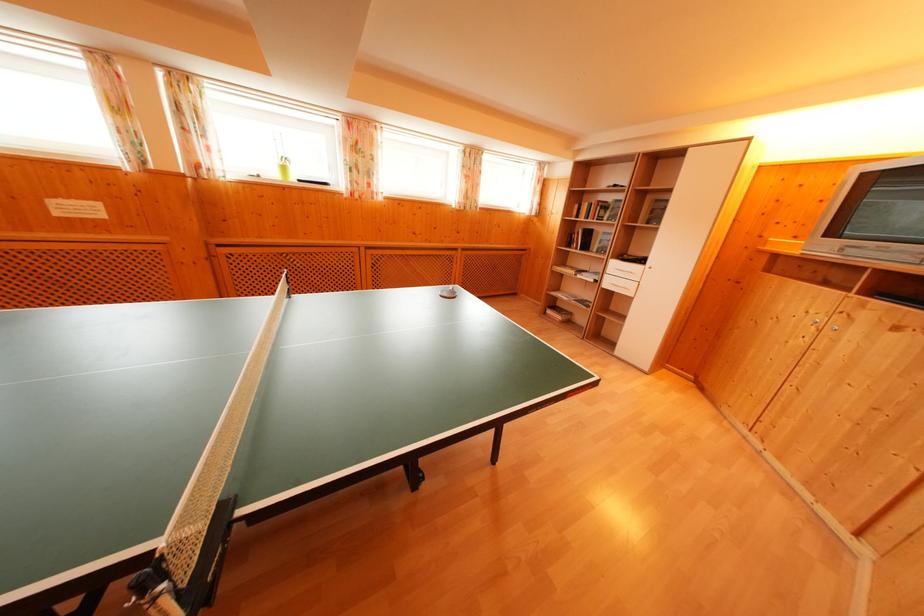
The width and height of the screenshot is (924, 616). I want to click on white drawer pull, so click(622, 285).